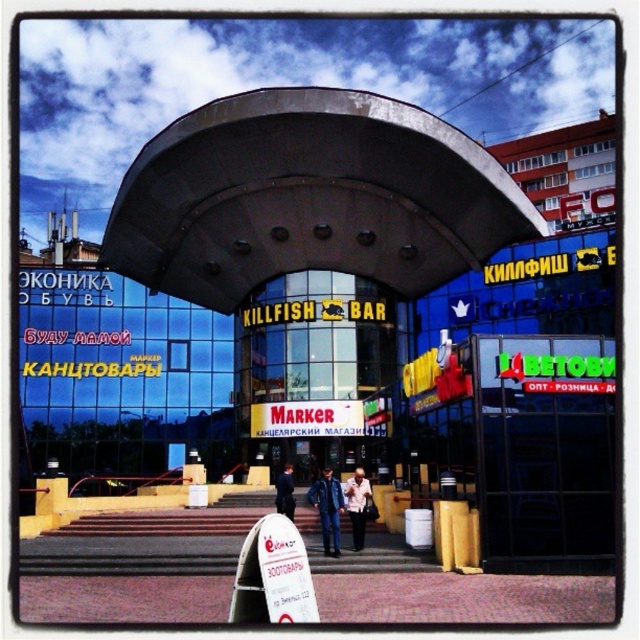
Question: Which object is farther from the camera taking this photo?

Choices:
 (A) white plastic sign at center
 (B) light brown leather jacket at center

Answer: (B)

Question: Is red plastic marker at center above dark blue jacket at center?

Choices:
 (A) no
 (B) yes

Answer: (B)

Question: Among these points, which one is farthest from the camera?

Choices:
 (A) (355, 195)
 (B) (360, 467)
 (C) (324, 547)
 (D) (282, 493)

Answer: (B)

Question: Does dark gray metallic canopy at center appear on the right side of white plastic sign at center?

Choices:
 (A) yes
 (B) no

Answer: (A)

Question: Is white plastic sign at center above light brown leather jacket at center?

Choices:
 (A) yes
 (B) no

Answer: (A)

Question: Which of these objects is positioned closest to the dark blue jacket at center?

Choices:
 (A) white plastic sign at center
 (B) red plastic marker at center

Answer: (B)